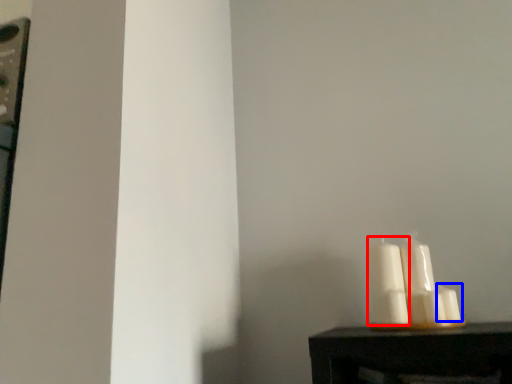
Question: Which point is closer to the camera, candle (highlighted by a red box) or candle (highlighted by a blue box)?

Choices:
 (A) candle
 (B) candle

Answer: (B)